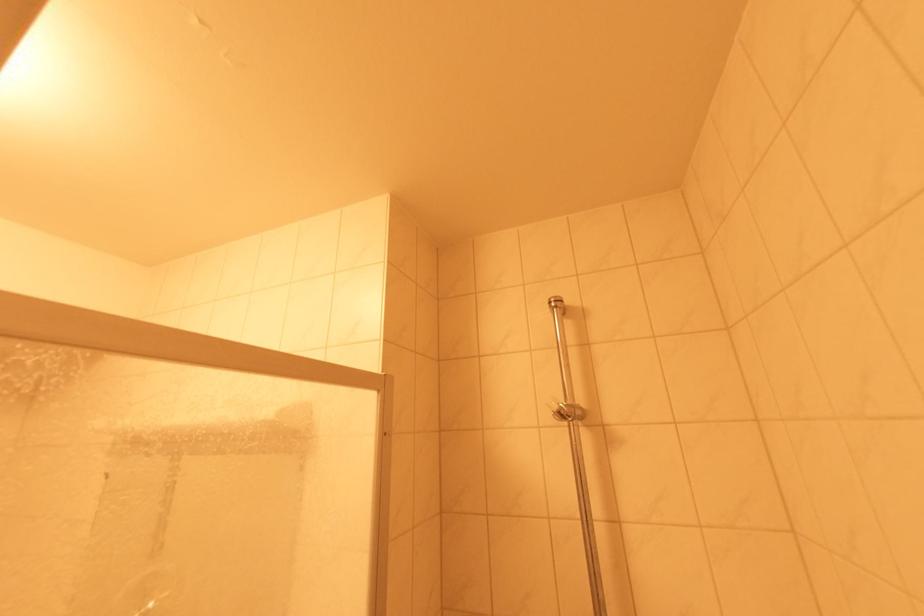
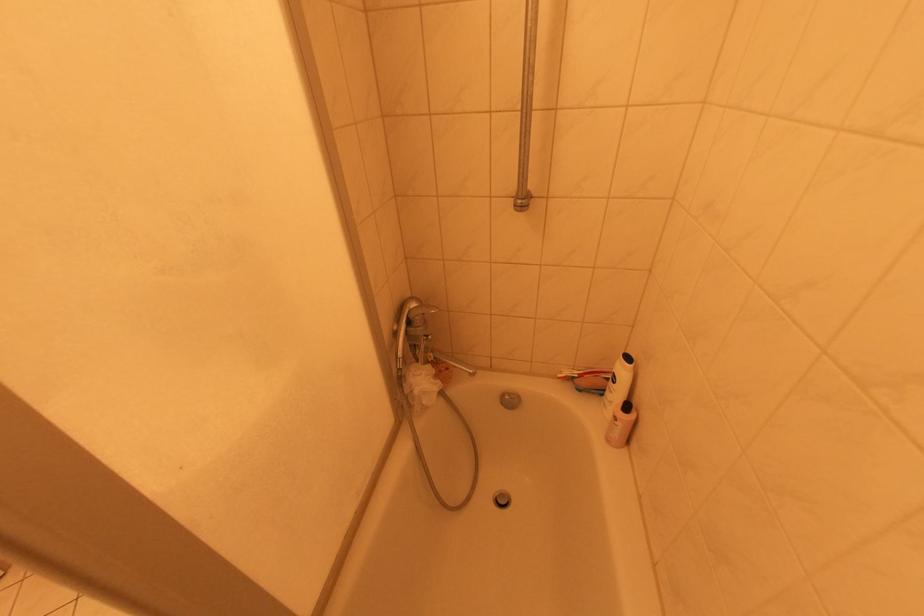
Question: The first image is from the beginning of the video and the second image is from the end. How did the camera likely rotate when shooting the video?

Choices:
 (A) Left
 (B) Right
 (C) Up
 (D) Down

Answer: (D)